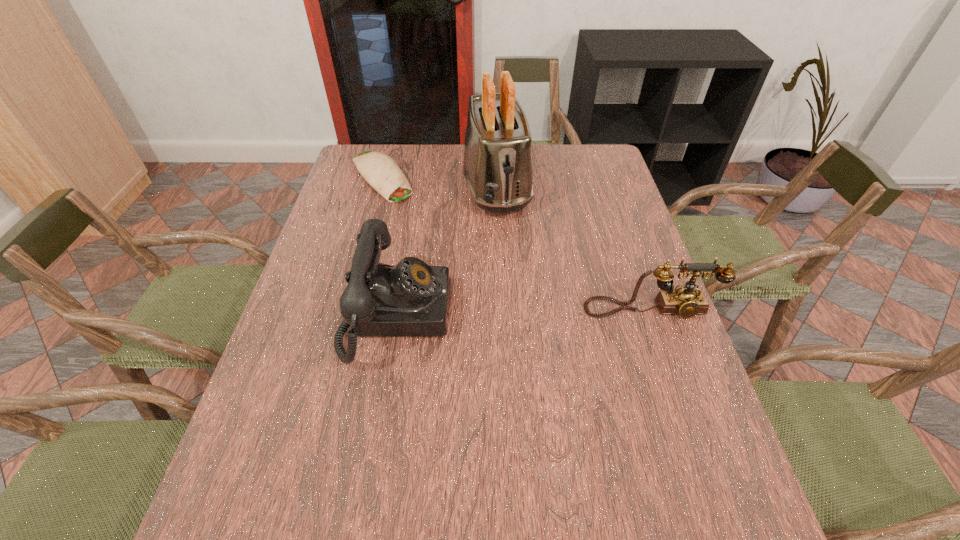
This screenshot has width=960, height=540. I want to click on vacant spot on the desktop that is between the third shortest object and the rightmost object and is positioned on the side of the toaster with the control lever, so click(531, 312).

This screenshot has height=540, width=960. What are the coordinates of `free space on the desktop that is between the taller telephone and the shorter telephone and is positioned at the bitten end of the burrito` in the screenshot? It's located at (503, 313).